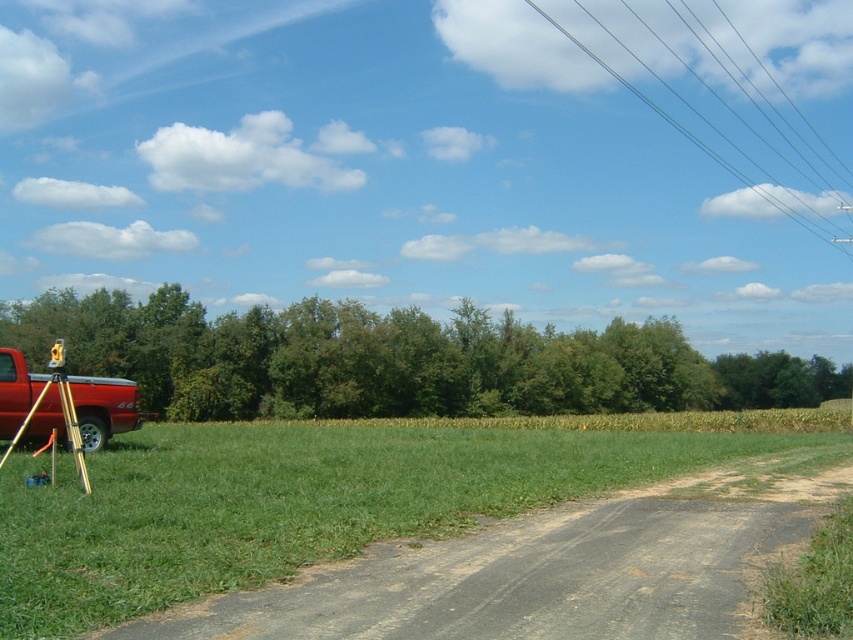
Who is lower down, gray asphalt road at lower center or metallic red pickup truck at left?

Positioned lower is gray asphalt road at lower center.

Does point (724, 552) come farther from viewer compared to point (54, 403)?

No, it is not.

Locate an element on the screen. The width and height of the screenshot is (853, 640). gray asphalt road at lower center is located at coordinates (550, 568).

Between black wire at upper right and gold metallic tripod at lower left, which one appears on the left side from the viewer's perspective?

From the viewer's perspective, gold metallic tripod at lower left appears more on the left side.

The width and height of the screenshot is (853, 640). Describe the element at coordinates (689, 132) in the screenshot. I see `black wire at upper right` at that location.

This screenshot has height=640, width=853. What are the coordinates of `black wire at upper right` in the screenshot? It's located at (689, 132).

The height and width of the screenshot is (640, 853). Identify the location of metallic red pickup truck at left. (103, 408).

Is metallic red pickup truck at left wider than black wire at upper right?

In fact, metallic red pickup truck at left might be narrower than black wire at upper right.

Is point (48, 400) closer to viewer compared to point (604, 64)?

Yes.

The width and height of the screenshot is (853, 640). Identify the location of metallic red pickup truck at left. (103, 408).